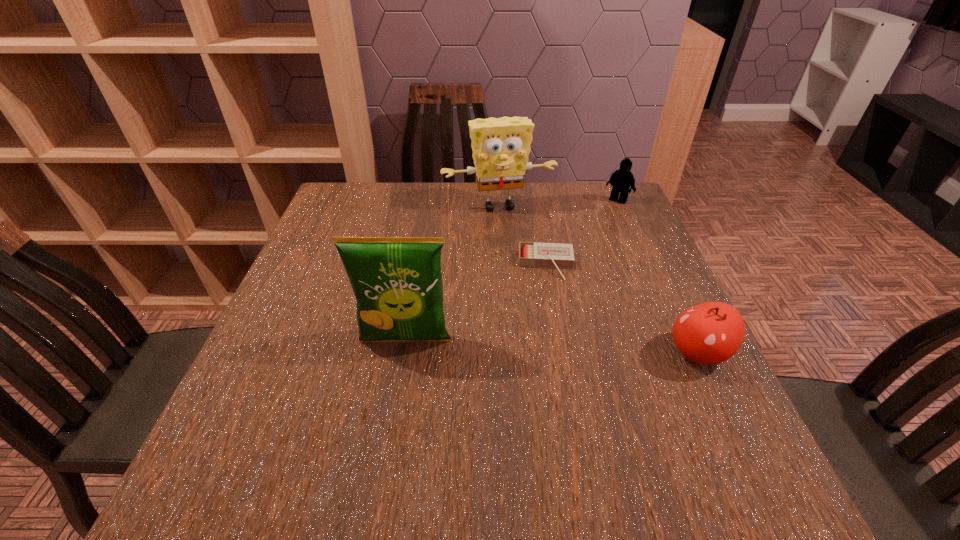
At what (x,y) coordinates should I click in order to perform the action: click on vacant space that's between the sponge and the crisp (potato chip). Please return your answer as a coordinate pair (x, y). The height and width of the screenshot is (540, 960). Looking at the image, I should click on (452, 273).

Image resolution: width=960 pixels, height=540 pixels. I want to click on unoccupied area between the apple and the crisp (potato chip), so click(552, 347).

At what (x,y) coordinates should I click in order to perform the action: click on vacant area that lies between the third farthest object and the sponge. Please return your answer as a coordinate pair (x, y). This screenshot has width=960, height=540. Looking at the image, I should click on (522, 235).

At what (x,y) coordinates should I click in order to perform the action: click on free point between the shortest object and the sponge. Please return your answer as a coordinate pair (x, y). The image size is (960, 540). Looking at the image, I should click on (522, 235).

Find the location of a particular element. free area in between the third farthest object and the crisp (potato chip) is located at coordinates (476, 303).

This screenshot has width=960, height=540. I want to click on free space between the apple and the matchbox, so click(x=622, y=309).

The height and width of the screenshot is (540, 960). Identify the location of vacant region between the third farthest object and the crisp (potato chip). (476, 303).

The image size is (960, 540). In order to click on free space that is in between the apple and the crisp (potato chip) in this screenshot , I will do `click(552, 347)`.

Locate which object ranks second in proximity to the sponge. Please provide its 2D coordinates. Your answer should be formatted as a tuple, i.e. [(x, y)], where the tuple contains the x and y coordinates of a point satisfying the conditions above.

[(622, 179)]

Locate an element on the screen. Image resolution: width=960 pixels, height=540 pixels. object that is the fourth closest one to the apple is located at coordinates (622, 179).